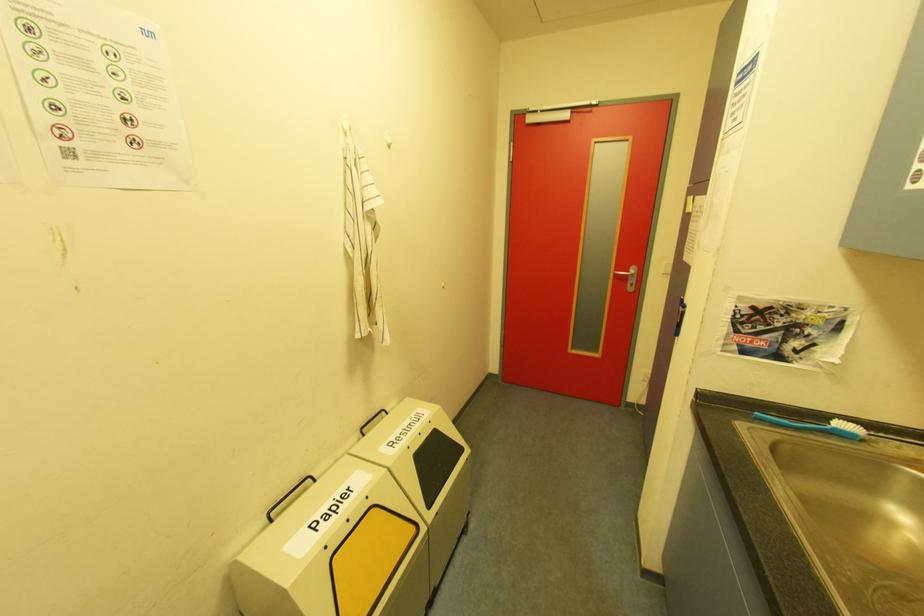
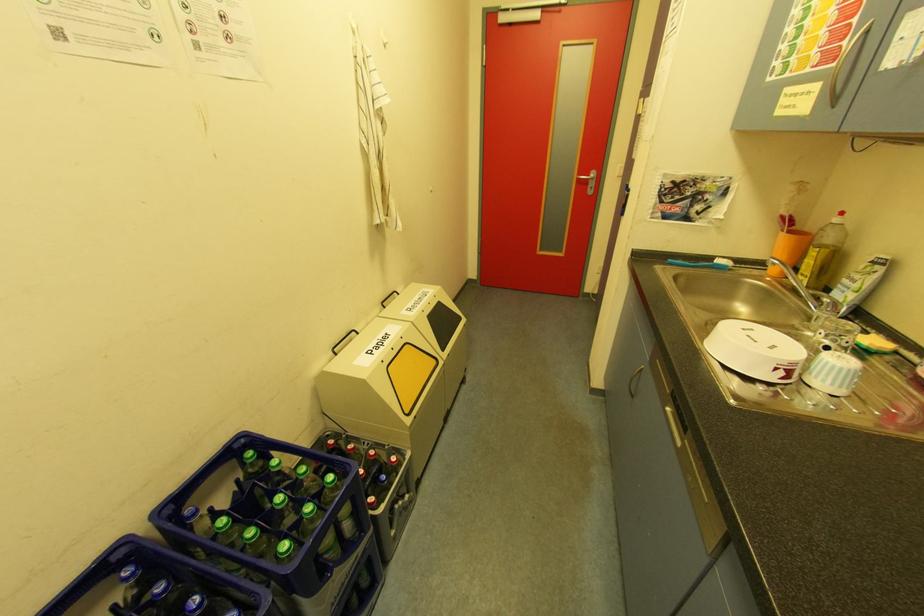
Question: Based on the continuous images, in which direction is the camera rotating? Reply with the corresponding letter.

Choices:
 (A) Left
 (B) Right
 (C) Up
 (D) Down

Answer: (D)